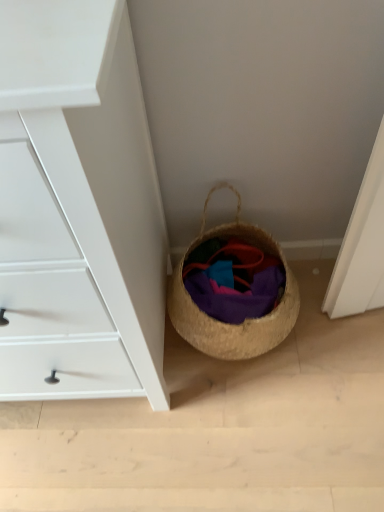
Find the location of a particular element. The image size is (384, 512). empty space that is in between white matte chest of drawers at lower left and woven straw basket at lower right is located at coordinates (226, 391).